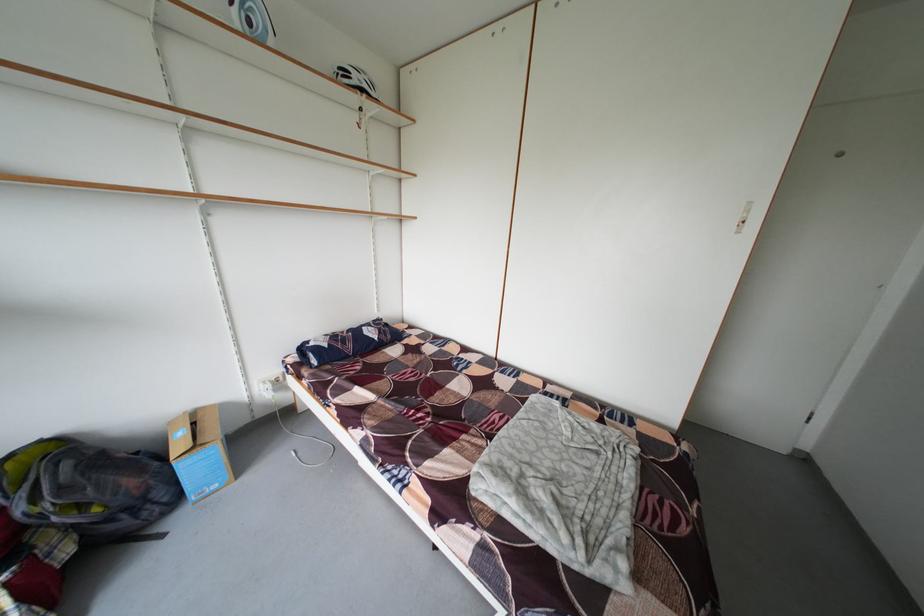
Locate an element on the screen. The image size is (924, 616). grey folded blanket is located at coordinates (565, 488).